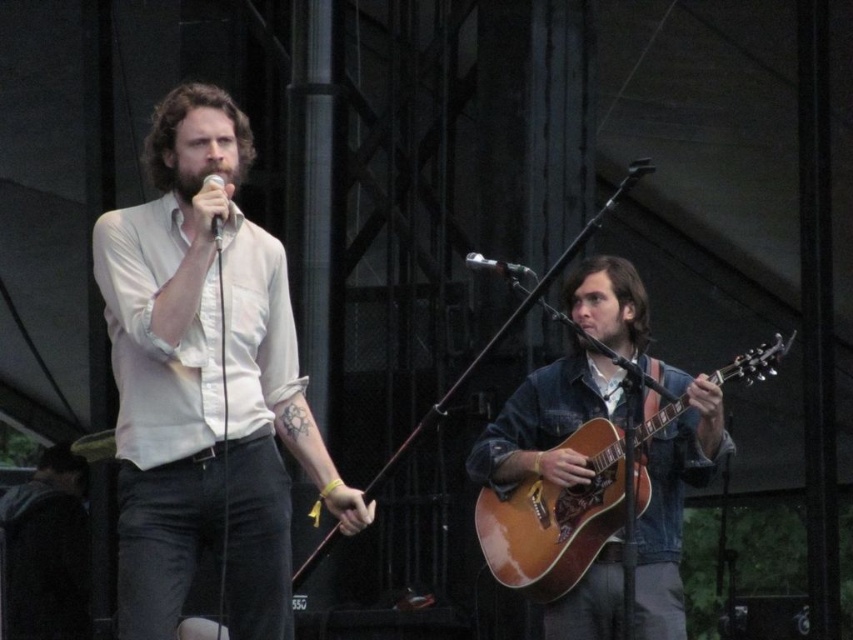
You are a photographer standing in front of the stage. You want to take a picture of the white cotton shirt at center. Where should you aim your camera?

You should aim your camera at point 0.600 on the x axis and point 0.242 on the y axis to capture the white cotton shirt at center.

You are a photographer positioned at the back of the audience. You want to take a photo of both the white cotton shirt at center and the wooden acoustic guitar at right. Which object will appear larger in your photo?

The white cotton shirt at center will appear larger in the photo because it is closer to the viewer than the wooden acoustic guitar at right.

You are a sound technician setting up for a concert. You need to adjust the metallic silver microphone at center and the matte black microphone at upper center. According to the stage setup, which microphone is placed lower?

The metallic silver microphone at center is positioned under the matte black microphone at upper center, so the metallic silver microphone at center is placed lower.